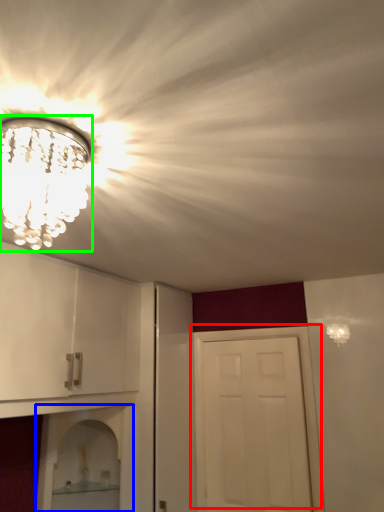
Question: Which object is the closest to the door (highlighted by a red box)? Choose among these: shelf (highlighted by a blue box) or light fixture (highlighted by a green box).

Choices:
 (A) shelf
 (B) light fixture

Answer: (A)